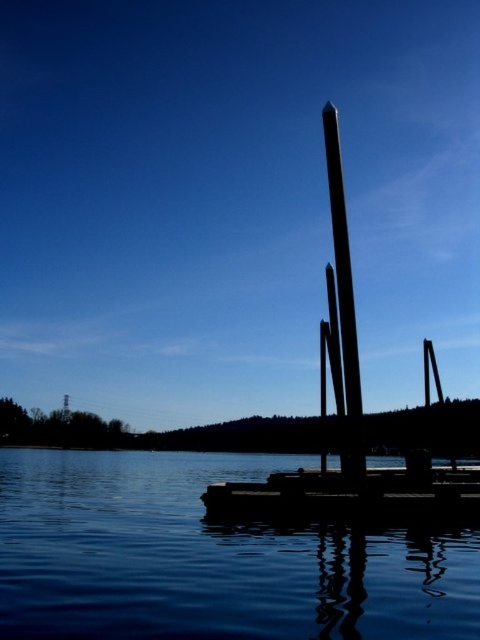
Does point (317, 550) lie in front of point (337, 220)?

Yes, it is.

Is transparent water at center wider than black polished pole at center?

Correct, the width of transparent water at center exceeds that of black polished pole at center.

Identify the location of transparent water at center. (208, 557).

This screenshot has width=480, height=640. I want to click on transparent water at center, so click(208, 557).

Who is shorter, transparent water at center or smooth wood dock at center?

Standing shorter between the two is smooth wood dock at center.

Is transparent water at center positioned behind smooth wood dock at center?

No, it is not.

Who is more distant from viewer, (202, 525) or (219, 506)?

The point (219, 506) is more distant.

Find the location of a particular element. Image resolution: width=480 pixels, height=640 pixels. transparent water at center is located at coordinates (208, 557).

Is smooth wood dock at center shorter than black polished pole at center?

Correct, smooth wood dock at center is not as tall as black polished pole at center.

Who is more forward, (373,493) or (349,310)?

Positioned in front is point (349,310).

Which is behind, point (444, 492) or point (363, 468)?

The point (363, 468) is behind.

The image size is (480, 640). What are the coordinates of `smooth wood dock at center` in the screenshot? It's located at (352, 493).